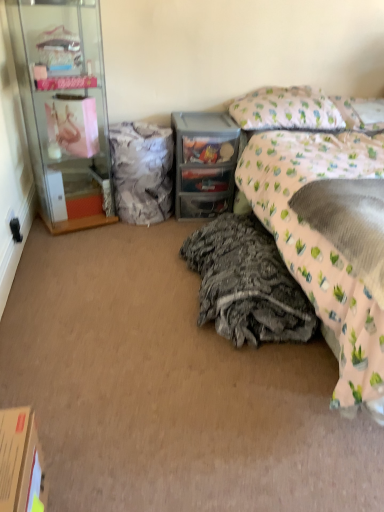
Where is `empty space that is in between translucent plastic drawer at center and cardboard box at lower left`? The image size is (384, 512). empty space that is in between translucent plastic drawer at center and cardboard box at lower left is located at coordinates (124, 334).